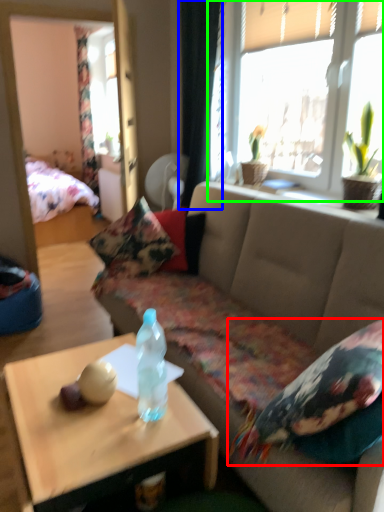
Question: Which object is positioned closest to pillow (highlighted by a red box)? Select from curtain (highlighted by a blue box) and window (highlighted by a green box).

Choices:
 (A) curtain
 (B) window

Answer: (B)